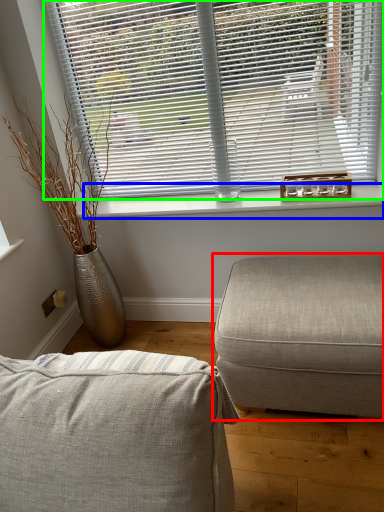
Question: Which object is the closest to the studio couch (highlighted by a red box)? Choose among these: window sill (highlighted by a blue box) or window blind (highlighted by a green box).

Choices:
 (A) window sill
 (B) window blind

Answer: (A)